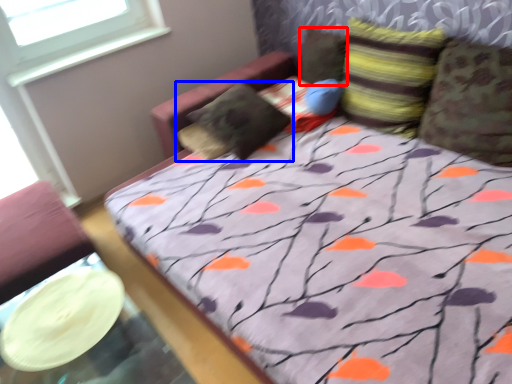
Question: Which object is further to the camera taking this photo, pillow (highlighted by a red box) or pillow (highlighted by a blue box)?

Choices:
 (A) pillow
 (B) pillow

Answer: (A)